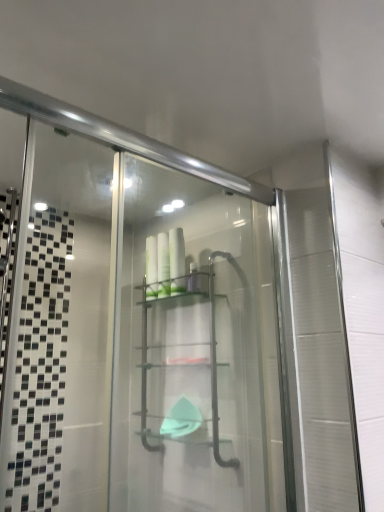
Question: Considering the relative positions of clear plastic shelf at center and white glossy bottles at center, the 2th toiletry viewed from the left, in the image provided, is clear plastic shelf at center to the left or to the right of white glossy bottles at center, the 2th toiletry viewed from the left,?

Choices:
 (A) right
 (B) left

Answer: (B)

Question: From the image's perspective, is clear plastic shelf at center above or below white glossy bottles at center, the 1th toiletry in the right-to-left sequence?

Choices:
 (A) below
 (B) above

Answer: (A)

Question: Based on their relative distances, which object is farther from the white glossy bottles at center, the 1th toiletry in the right-to-left sequence?

Choices:
 (A) white glossy bottles at center, which is the first toiletry from left to right
 (B) clear plastic shelf at center

Answer: (B)

Question: Which object is positioned closest to the white glossy bottles at center, the 2th toiletry from the right?

Choices:
 (A) clear plastic shelf at center
 (B) white glossy bottles at center, the 1th toiletry in the right-to-left sequence

Answer: (B)